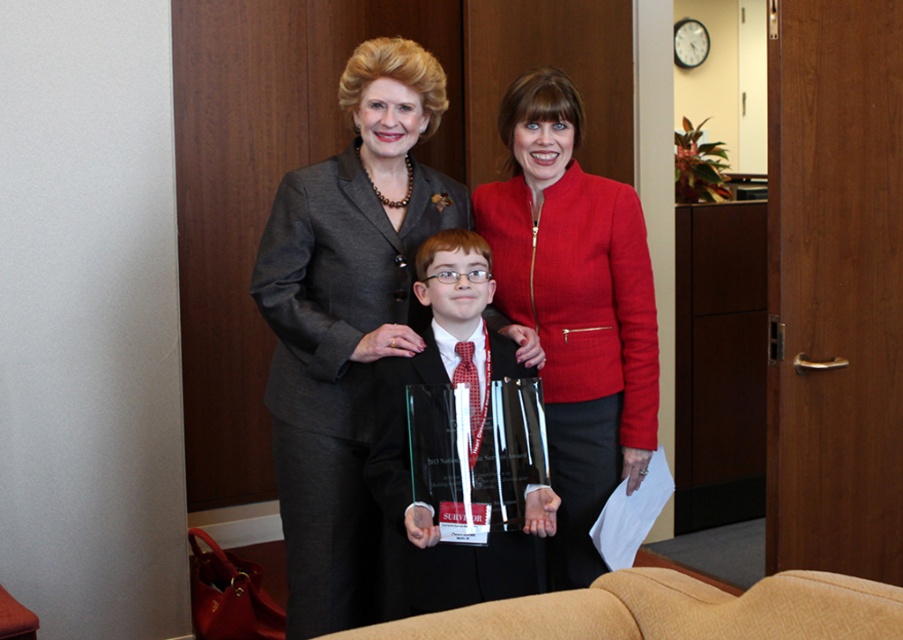
Does matte red blazer at center have a larger size compared to clear glass award at center?

Indeed, matte red blazer at center has a larger size compared to clear glass award at center.

Between point (580, 280) and point (391, 612), which one is positioned behind?

Positioned behind is point (391, 612).

You are a GUI agent. You are given a task and a screenshot of the screen. Output one action in this format:
    pyautogui.click(x=<x>, y=<y>)
    Task: Click on the matte red blazer at center
    
    Given the screenshot: What is the action you would take?
    pyautogui.click(x=574, y=307)

Is point (303, 499) behind point (453, 579)?

Yes, point (303, 499) is farther from viewer.

Describe the element at coordinates (336, 368) in the screenshot. This screenshot has height=640, width=903. I see `matte gray business suit at center` at that location.

Which is in front, point (313, 420) or point (477, 364)?

Point (477, 364) is in front.

Locate an element on the screen. The width and height of the screenshot is (903, 640). matte gray business suit at center is located at coordinates (336, 368).

Which of these two, matte gray business suit at center or matte red blazer at center, stands taller?

Standing taller between the two is matte red blazer at center.

Does matte gray business suit at center lie in front of matte red blazer at center?

No, it is behind matte red blazer at center.

You are a GUI agent. You are given a task and a screenshot of the screen. Output one action in this format:
    pyautogui.click(x=<x>, y=<y>)
    Task: Click on the matte gray business suit at center
    The height and width of the screenshot is (640, 903).
    Given the screenshot: What is the action you would take?
    pyautogui.click(x=336, y=368)

I want to click on matte gray business suit at center, so click(336, 368).